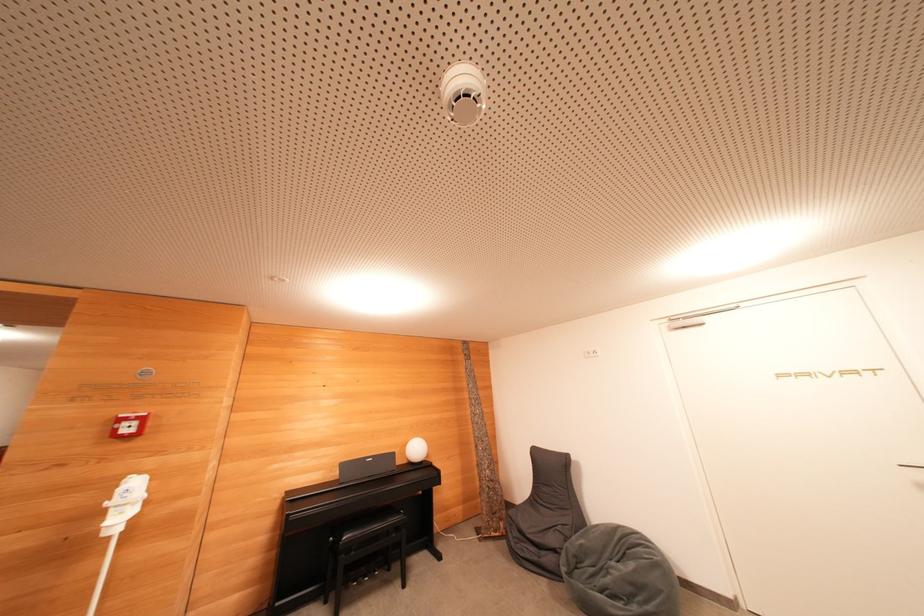
Image resolution: width=924 pixels, height=616 pixels. Find the location of `chair sitting surface`. chair sitting surface is located at coordinates (372, 523).